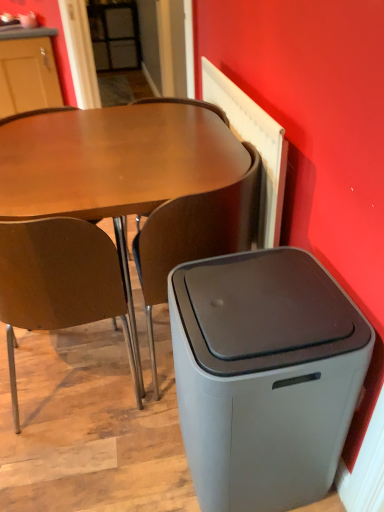
The height and width of the screenshot is (512, 384). In order to click on matte brown desk at center in this screenshot , I will do `click(114, 167)`.

Image resolution: width=384 pixels, height=512 pixels. What are the coordinates of `matte brown desk at center` in the screenshot? It's located at (114, 167).

From the picture: Is brown wood chair at left, positioned as the first chair in left-to-right order, inside or outside of gray matte trash bin/can at lower right?

The correct answer is: outside.

Is brown wood chair at left, positioned as the first chair in left-to-right order, at the left side of gray matte trash bin/can at lower right?

Yes.

Considering the positions of point (119, 281) and point (292, 490), is point (119, 281) closer or farther from the camera than point (292, 490)?

Clearly, point (119, 281) is more distant from the camera than point (292, 490).

From the image's perspective, is brown wood chair at left, positioned as the first chair in left-to-right order, above or below gray matte trash bin/can at lower right?

Based on their image positions, brown wood chair at left, positioned as the first chair in left-to-right order, is located above gray matte trash bin/can at lower right.

From the image's perspective, relative to brown matte chair at center, the first chair positioned from the right, is brown wood chair at left, which is the second chair in right-to-left order, above or below?

brown wood chair at left, which is the second chair in right-to-left order, is below brown matte chair at center, the first chair positioned from the right.

Could you tell me if brown wood chair at left, which is the second chair in right-to-left order, is facing brown matte chair at center, the first chair positioned from the right?

Yes, brown wood chair at left, which is the second chair in right-to-left order, is facing brown matte chair at center, the first chair positioned from the right.

In the scene shown: Could you measure the distance between brown wood chair at left, which is the second chair in right-to-left order, and brown matte chair at center, the first chair positioned from the right?

They are 9.80 inches apart.

Is the position of brown wood chair at left, which is the second chair in right-to-left order, less distant than that of brown matte chair at center, the first chair positioned from the right?

Yes, brown wood chair at left, which is the second chair in right-to-left order, is in front of brown matte chair at center, the first chair positioned from the right.

Does matte brown desk at center contain gray matte trash bin/can at lower right?

No, gray matte trash bin/can at lower right is located outside of matte brown desk at center.

Is matte brown desk at center facing away from gray matte trash bin/can at lower right?

No, gray matte trash bin/can at lower right is not at the back of matte brown desk at center.

In terms of size, does matte brown desk at center appear bigger or smaller than gray matte trash bin/can at lower right?

In the image, matte brown desk at center appears to be larger than gray matte trash bin/can at lower right.

From the image's perspective, which is above, gray matte trash bin/can at lower right or brown wood chair at left, which is the second chair in right-to-left order?

From the image's view, brown wood chair at left, which is the second chair in right-to-left order, is above.

Who is more distant, gray matte trash bin/can at lower right or brown wood chair at left, positioned as the first chair in left-to-right order?

brown wood chair at left, positioned as the first chair in left-to-right order, is more distant.

From a real-world perspective, between gray matte trash bin/can at lower right and brown wood chair at left, positioned as the first chair in left-to-right order, who is vertically lower?

gray matte trash bin/can at lower right.

Which object is positioned more to the left, brown matte chair at center, the first chair positioned from the right, or gray matte trash bin/can at lower right?

From the viewer's perspective, brown matte chair at center, the first chair positioned from the right, appears more on the left side.

From the picture: From a real-world perspective, is brown matte chair at center, the first chair positioned from the right, on gray matte trash bin/can at lower right?

Yes, from a real-world perspective, brown matte chair at center, the first chair positioned from the right, is on top of gray matte trash bin/can at lower right.

In the scene shown: Which of these two, brown matte chair at center, which is counted as the 2th chair, starting from the left, or gray matte trash bin/can at lower right, stands taller?

Standing taller between the two is brown matte chair at center, which is counted as the 2th chair, starting from the left.

Considering the points (196, 259) and (276, 285), which point is in front, point (196, 259) or point (276, 285)?

Point (276, 285)

Is brown matte chair at center, which is counted as the 2th chair, starting from the left, not close to matte brown desk at center?

brown matte chair at center, which is counted as the 2th chair, starting from the left, is near matte brown desk at center, not far away.

Is brown matte chair at center, the first chair positioned from the right, taller or shorter than matte brown desk at center?

In the image, brown matte chair at center, the first chair positioned from the right, appears to be taller than matte brown desk at center.

Does brown matte chair at center, the first chair positioned from the right, have a greater width compared to matte brown desk at center?

No.

Which object is positioned more to the left, brown matte chair at center, the first chair positioned from the right, or matte brown desk at center?

matte brown desk at center.

Is matte brown desk at center with brown wood chair at left, positioned as the first chair in left-to-right order?

No, matte brown desk at center is not touching brown wood chair at left, positioned as the first chair in left-to-right order.

Considering the relative sizes of matte brown desk at center and brown wood chair at left, positioned as the first chair in left-to-right order, in the image provided, is matte brown desk at center thinner than brown wood chair at left, positioned as the first chair in left-to-right order,?

No.

From the image's perspective, between matte brown desk at center and brown wood chair at left, which is the second chair in right-to-left order, which one is located above?

matte brown desk at center.

Is matte brown desk at center closer to the viewer compared to brown wood chair at left, positioned as the first chair in left-to-right order?

No, matte brown desk at center is behind brown wood chair at left, positioned as the first chair in left-to-right order.

I want to click on the 2nd chair to the left when counting from the gray matte trash bin/can at lower right, so click(x=58, y=283).

The width and height of the screenshot is (384, 512). Find the location of `chair on the right side of brown wood chair at left, positioned as the first chair in left-to-right order`. chair on the right side of brown wood chair at left, positioned as the first chair in left-to-right order is located at coordinates (195, 236).

From the image, which object appears to be farther from brown wood chair at left, which is the second chair in right-to-left order, matte brown desk at center or gray matte trash bin/can at lower right?

The object further to brown wood chair at left, which is the second chair in right-to-left order, is gray matte trash bin/can at lower right.

From the image, which object appears to be farther from matte brown desk at center, brown matte chair at center, which is counted as the 2th chair, starting from the left, or gray matte trash bin/can at lower right?

gray matte trash bin/can at lower right is positioned further to the anchor matte brown desk at center.

Looking at the image, which one is located closer to matte brown desk at center, brown wood chair at left, positioned as the first chair in left-to-right order, or gray matte trash bin/can at lower right?

brown wood chair at left, positioned as the first chair in left-to-right order.

From the image, which object appears to be farther from brown matte chair at center, which is counted as the 2th chair, starting from the left, matte brown desk at center or brown wood chair at left, which is the second chair in right-to-left order?

Among the two, matte brown desk at center is located further to brown matte chair at center, which is counted as the 2th chair, starting from the left.

From the image, which object appears to be nearer to brown wood chair at left, which is the second chair in right-to-left order, brown matte chair at center, the first chair positioned from the right, or matte brown desk at center?

brown matte chair at center, the first chair positioned from the right, is closer to brown wood chair at left, which is the second chair in right-to-left order.

When comparing their distances from gray matte trash bin/can at lower right, does brown wood chair at left, positioned as the first chair in left-to-right order, or brown matte chair at center, the first chair positioned from the right, seem further?

brown wood chair at left, positioned as the first chair in left-to-right order, is positioned further to the anchor gray matte trash bin/can at lower right.

When comparing their distances from brown wood chair at left, which is the second chair in right-to-left order, does gray matte trash bin/can at lower right or matte brown desk at center seem closer?

matte brown desk at center lies closer to brown wood chair at left, which is the second chair in right-to-left order, than the other object.

Based on their spatial positions, is gray matte trash bin/can at lower right or matte brown desk at center further from brown matte chair at center, the first chair positioned from the right?

The object further to brown matte chair at center, the first chair positioned from the right, is gray matte trash bin/can at lower right.

I want to click on chair between brown wood chair at left, which is the second chair in right-to-left order, and gray matte trash bin/can at lower right from left to right, so click(x=195, y=236).

Where is `chair between matte brown desk at center and gray matte trash bin/can at lower right`? This screenshot has height=512, width=384. chair between matte brown desk at center and gray matte trash bin/can at lower right is located at coordinates (195, 236).

Locate an element on the screen. The height and width of the screenshot is (512, 384). desk between brown wood chair at left, which is the second chair in right-to-left order, and brown matte chair at center, the first chair positioned from the right, in the horizontal direction is located at coordinates (114, 167).

This screenshot has height=512, width=384. In order to click on desk between brown wood chair at left, which is the second chair in right-to-left order, and gray matte trash bin/can at lower right, in the horizontal direction in this screenshot , I will do `click(114, 167)`.